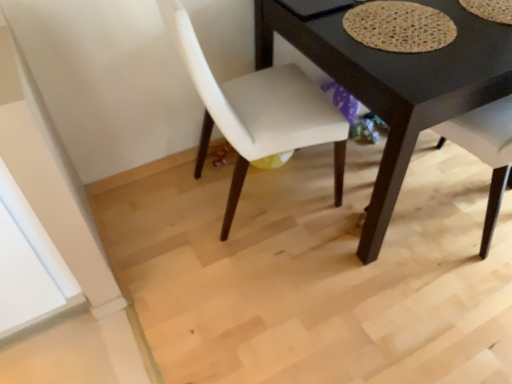
Where is `blank area to the left of white fabric chair at center`? This screenshot has width=512, height=384. blank area to the left of white fabric chair at center is located at coordinates (158, 213).